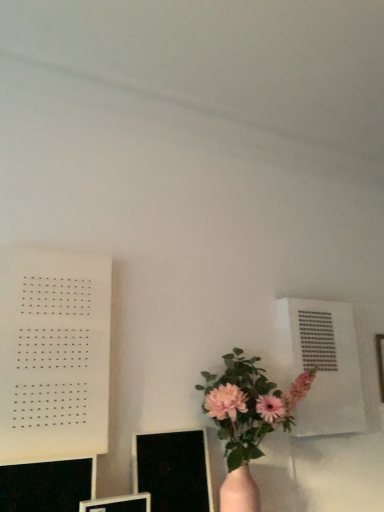
Question: From a real-world perspective, is matte black monitor at lower left, the 2th computer monitor from the left, beneath black glossy computer monitor at lower left, the first computer monitor viewed from the left?

Choices:
 (A) yes
 (B) no

Answer: (A)

Question: Considering the relative sizes of matte black monitor at lower left, the 2th computer monitor from the left, and black glossy computer monitor at lower left, which is the third computer monitor in right-to-left order, in the image provided, is matte black monitor at lower left, the 2th computer monitor from the left, smaller than black glossy computer monitor at lower left, which is the third computer monitor in right-to-left order,?

Choices:
 (A) yes
 (B) no

Answer: (A)

Question: From the image's perspective, is matte black monitor at lower left, marked as the second computer monitor in a right-to-left arrangement, below black glossy computer monitor at lower left, which is the third computer monitor in right-to-left order?

Choices:
 (A) yes
 (B) no

Answer: (A)

Question: Is matte black monitor at lower left, marked as the second computer monitor in a right-to-left arrangement, shorter than black glossy computer monitor at lower left, the first computer monitor viewed from the left?

Choices:
 (A) yes
 (B) no

Answer: (A)

Question: Is matte black monitor at lower left, the 2th computer monitor from the left, taller than black glossy computer monitor at lower left, which is the third computer monitor in right-to-left order?

Choices:
 (A) yes
 (B) no

Answer: (B)

Question: Does matte black monitor at lower left, the 2th computer monitor from the left, have a larger size compared to black glossy computer monitor at lower left, the first computer monitor viewed from the left?

Choices:
 (A) yes
 (B) no

Answer: (B)

Question: Is there a large distance between matte black monitor at lower left, marked as the second computer monitor in a right-to-left arrangement, and black glossy computer monitor at lower center, acting as the first computer monitor starting from the right?

Choices:
 (A) no
 (B) yes

Answer: (A)

Question: Considering the relative sizes of matte black monitor at lower left, marked as the second computer monitor in a right-to-left arrangement, and black glossy computer monitor at lower center, which appears as the 3th computer monitor when viewed from the left, in the image provided, is matte black monitor at lower left, marked as the second computer monitor in a right-to-left arrangement, smaller than black glossy computer monitor at lower center, which appears as the 3th computer monitor when viewed from the left,?

Choices:
 (A) yes
 (B) no

Answer: (A)

Question: Is matte black monitor at lower left, marked as the second computer monitor in a right-to-left arrangement, at the left side of black glossy computer monitor at lower center, acting as the first computer monitor starting from the right?

Choices:
 (A) yes
 (B) no

Answer: (A)

Question: Would you say black glossy computer monitor at lower center, acting as the first computer monitor starting from the right, is part of matte black monitor at lower left, the 2th computer monitor from the left,'s contents?

Choices:
 (A) yes
 (B) no

Answer: (B)

Question: Does matte black monitor at lower left, marked as the second computer monitor in a right-to-left arrangement, have a lesser height compared to black glossy computer monitor at lower center, acting as the first computer monitor starting from the right?

Choices:
 (A) yes
 (B) no

Answer: (A)

Question: From a real-world perspective, is matte black monitor at lower left, marked as the second computer monitor in a right-to-left arrangement, positioned over black glossy computer monitor at lower center, acting as the first computer monitor starting from the right, based on gravity?

Choices:
 (A) yes
 (B) no

Answer: (B)

Question: Is white paper at left shorter than pink matte vase at lower center?

Choices:
 (A) yes
 (B) no

Answer: (B)